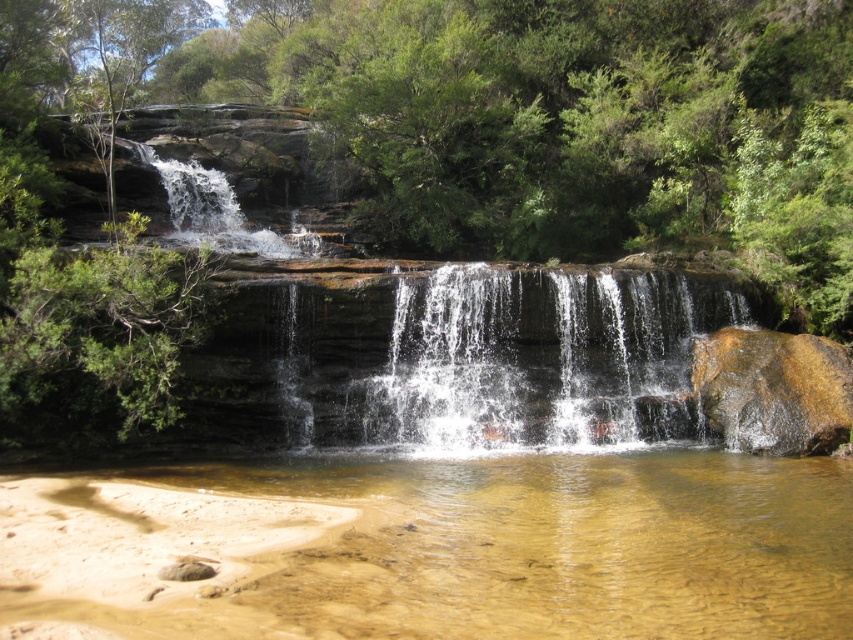
You are standing at the base of the waterfall and want to reach a specific point marked as point (x=256, y=582). Considering the waterfall is in front of you, in which direction should you move to get closer to this point?

The point (x=256, y=582) is 6.70 meters away from the viewer. Since the waterfall is in front of you, you should move forward towards the waterfall to get closer to the point.

You are standing at the base of the waterfall and want to reach a specific point marked at coordinates point (695, 420). If your maximum comfortable walking distance is 50 feet, will you be able to comfortably reach that point?

The distance of point (695, 420) from viewer is 55.69 feet, which exceeds your maximum comfortable walking distance of 50 feet. Therefore, you will not be able to comfortably reach that point.